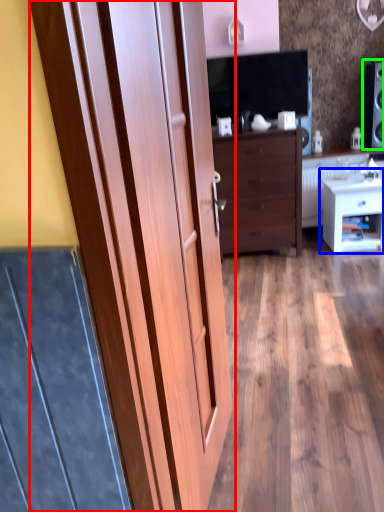
Question: Which is nearer to the door (highlighted by a red box)? nightstand (highlighted by a blue box) or speaker (highlighted by a green box).

Choices:
 (A) nightstand
 (B) speaker

Answer: (A)